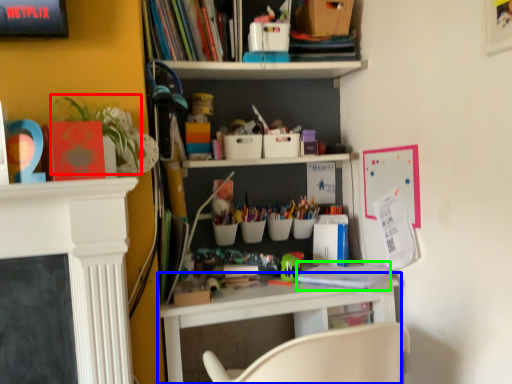
Question: Estimate the real-world distances between objects in this image. Which object is closer to plant (highlighted by a red box), shelf (highlighted by a blue box) or book (highlighted by a green box)?

Choices:
 (A) shelf
 (B) book

Answer: (A)